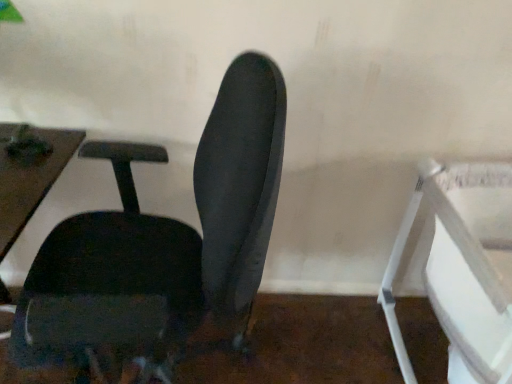
Question: Is white plastic feeding chair at right shorter than matte black chair at center?

Choices:
 (A) yes
 (B) no

Answer: (A)

Question: From the image's perspective, is white plastic feeding chair at right above matte black chair at center?

Choices:
 (A) yes
 (B) no

Answer: (B)

Question: Is white plastic feeding chair at right next to matte black chair at center and touching it?

Choices:
 (A) no
 (B) yes

Answer: (A)

Question: Is white plastic feeding chair at right turned away from matte black chair at center?

Choices:
 (A) no
 (B) yes

Answer: (A)

Question: From a real-world perspective, is white plastic feeding chair at right under matte black chair at center?

Choices:
 (A) yes
 (B) no

Answer: (A)

Question: Can you confirm if white plastic feeding chair at right is wider than matte black chair at center?

Choices:
 (A) yes
 (B) no

Answer: (A)

Question: From a real-world perspective, does matte black chair at center sit lower than white plastic feeding chair at right?

Choices:
 (A) yes
 (B) no

Answer: (B)

Question: Is matte black chair at center taller than white plastic feeding chair at right?

Choices:
 (A) yes
 (B) no

Answer: (A)

Question: Can you confirm if matte black chair at center is positioned to the right of white plastic feeding chair at right?

Choices:
 (A) no
 (B) yes

Answer: (A)

Question: Does matte black chair at center have a lesser width compared to white plastic feeding chair at right?

Choices:
 (A) no
 (B) yes

Answer: (B)

Question: From the image's perspective, is matte black chair at center below white plastic feeding chair at right?

Choices:
 (A) yes
 (B) no

Answer: (B)

Question: From the image's perspective, is matte black chair at center above white plastic feeding chair at right?

Choices:
 (A) no
 (B) yes

Answer: (B)

Question: Considering their positions, is white plastic feeding chair at right located in front of or behind matte black chair at center?

Choices:
 (A) behind
 (B) front

Answer: (A)